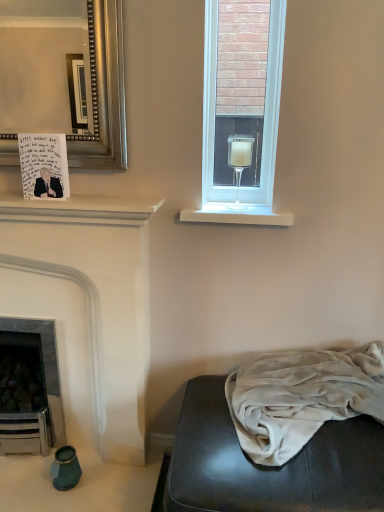
Identify the location of empty space that is ontop of velvet gray studio couch at lower right (from a real-world perspective). This screenshot has height=512, width=384. (292, 428).